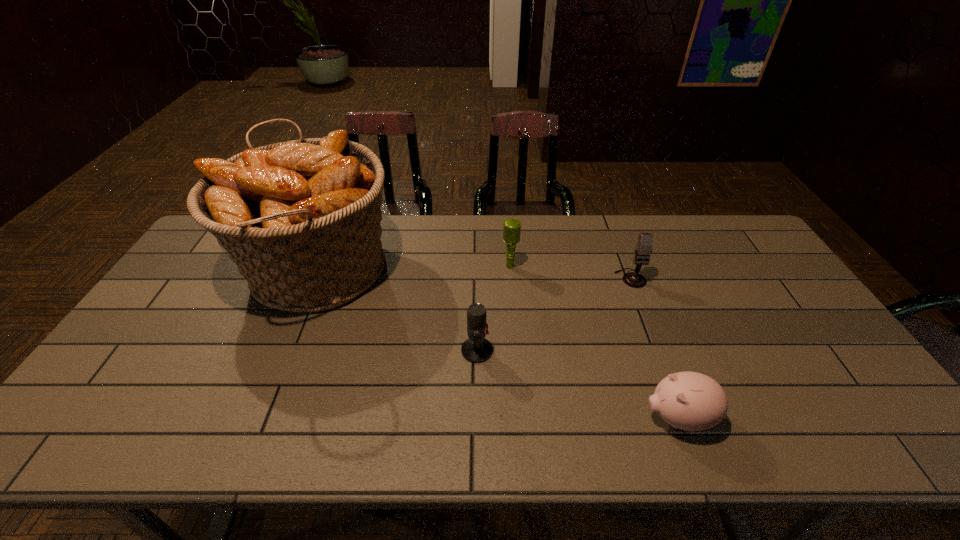
The height and width of the screenshot is (540, 960). Find the location of `the tallest object`. the tallest object is located at coordinates (301, 219).

What are the coordinates of `the leftmost object` in the screenshot? It's located at (301, 219).

Find the location of a particular element. The height and width of the screenshot is (540, 960). the second microphone from right to left is located at coordinates coord(512,227).

Find the location of a particular element. Image resolution: width=960 pixels, height=540 pixels. the rightmost microphone is located at coordinates (643, 249).

Image resolution: width=960 pixels, height=540 pixels. I want to click on the fourth farthest object, so click(476, 349).

The image size is (960, 540). I want to click on the nearest microphone, so click(476, 349).

Locate an element on the screen. the nearest object is located at coordinates (691, 401).

This screenshot has height=540, width=960. Find the location of `the shortest object`. the shortest object is located at coordinates (691, 401).

Locate an element on the screen. blank space located 0.290m on the front of the tallest object is located at coordinates (249, 436).

This screenshot has width=960, height=540. What are the coordinates of `vacant space located 0.230m on the front of the third object from left to right` in the screenshot? It's located at (515, 327).